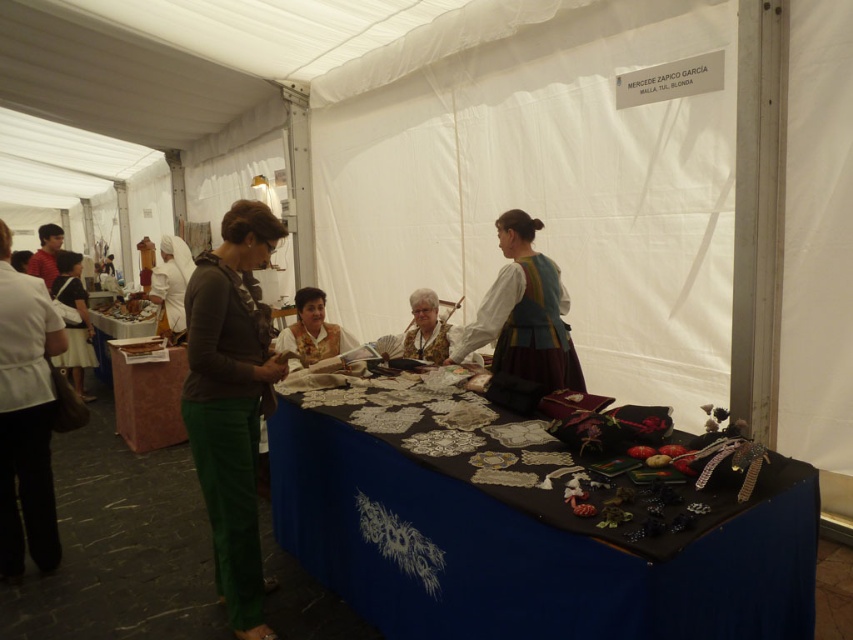
In the scene shown: You are a customer at the market and want to pick up an item from the marble table at center. However, there is a person wearing the matte black dress at lower left nearby. Based on their positions, can you easily access the table?

The marble table at center is positioned under the matte black dress at lower left, meaning the dress is above or in front of the table. This likely blocks direct access, making it difficult to reach the marble table at center without moving the person or object in the way.

You are a customer at the market and want to find the multicolored fabric dress at center. Based on the layout, where should you look relative to the table covered with a dark blue cloth?

The multicolored fabric dress at center is located at the coordinates point (524,314), which is near the center of the image. Since the table with dark blue cloth is in the foreground, the dress is likely positioned behind or to the side of the table, but closer to the central area of the scene.

You are a customer at the market and want to buy a pair of pants. You see the green fabric pants at left and the matte black dress at lower left. Which item is located lower on the person?

The green fabric pants at left is positioned under the matte black dress at lower left, so the green fabric pants at left is located lower on the person.